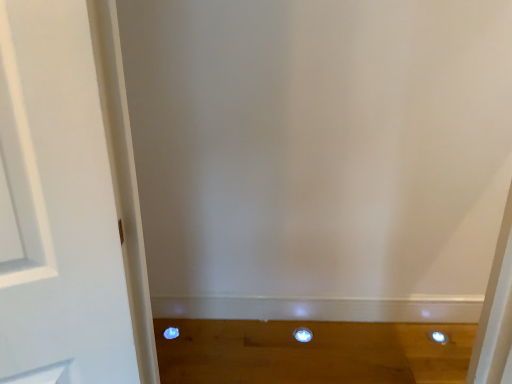
This screenshot has width=512, height=384. I want to click on matte blue dot at lower left, positioned as the 1th dot in left-to-right order, so [170, 333].

The height and width of the screenshot is (384, 512). What do you see at coordinates (170, 333) in the screenshot?
I see `matte blue dot at lower left, positioned as the 1th dot in left-to-right order` at bounding box center [170, 333].

What is the approximate height of matte blue dot at lower left, positioned as the 1th dot in left-to-right order?

The height of matte blue dot at lower left, positioned as the 1th dot in left-to-right order, is 1.21 inches.

Describe the element at coordinates (303, 335) in the screenshot. I see `white glossy dot at center, acting as the second dot starting from the left` at that location.

I want to click on white glossy dot at center, which appears as the 1th dot when viewed from the right, so click(303, 335).

Where is `matte blue dot at lower left, the second dot in the right-to-left sequence`? This screenshot has height=384, width=512. matte blue dot at lower left, the second dot in the right-to-left sequence is located at coordinates (170, 333).

Is matte blue dot at lower left, positioned as the 1th dot in left-to-right order, to the left or to the right of white glossy dot at center, which appears as the 1th dot when viewed from the right, in the image?

From the image, it's evident that matte blue dot at lower left, positioned as the 1th dot in left-to-right order, is to the left of white glossy dot at center, which appears as the 1th dot when viewed from the right.

Relative to white glossy dot at center, acting as the second dot starting from the left, is matte blue dot at lower left, the second dot in the right-to-left sequence, in front or behind?

Visually, matte blue dot at lower left, the second dot in the right-to-left sequence, is located behind white glossy dot at center, acting as the second dot starting from the left.

Which point is more forward, (173,338) or (298,332)?

The point (173,338) is closer to the camera.

From the image's perspective, who appears lower, matte blue dot at lower left, positioned as the 1th dot in left-to-right order, or white glossy dot at center, acting as the second dot starting from the left?

white glossy dot at center, acting as the second dot starting from the left, is shown below in the image.

From a real-world perspective, between matte blue dot at lower left, the second dot in the right-to-left sequence, and white glossy dot at center, which appears as the 1th dot when viewed from the right, who is vertically lower?

matte blue dot at lower left, the second dot in the right-to-left sequence, is physically lower.

In terms of width, does matte blue dot at lower left, the second dot in the right-to-left sequence, look wider or thinner when compared to white glossy dot at center, acting as the second dot starting from the left?

In the image, matte blue dot at lower left, the second dot in the right-to-left sequence, appears to be more narrow than white glossy dot at center, acting as the second dot starting from the left.

Can you confirm if matte blue dot at lower left, positioned as the 1th dot in left-to-right order, is shorter than white glossy dot at center, which appears as the 1th dot when viewed from the right?

Correct, matte blue dot at lower left, positioned as the 1th dot in left-to-right order, is not as tall as white glossy dot at center, which appears as the 1th dot when viewed from the right.

Looking at the image, does matte blue dot at lower left, the second dot in the right-to-left sequence, seem bigger or smaller compared to white glossy dot at center, acting as the second dot starting from the left?

Clearly, matte blue dot at lower left, the second dot in the right-to-left sequence, is smaller in size than white glossy dot at center, acting as the second dot starting from the left.

Would you say matte blue dot at lower left, the second dot in the right-to-left sequence, is outside white glossy dot at center, which appears as the 1th dot when viewed from the right?

Indeed, matte blue dot at lower left, the second dot in the right-to-left sequence, is completely outside white glossy dot at center, which appears as the 1th dot when viewed from the right.

Is matte blue dot at lower left, positioned as the 1th dot in left-to-right order, far from white glossy dot at center, which appears as the 1th dot when viewed from the right?

No.

Is matte blue dot at lower left, the second dot in the right-to-left sequence, oriented away from white glossy dot at center, which appears as the 1th dot when viewed from the right?

No, matte blue dot at lower left, the second dot in the right-to-left sequence, is not facing away from white glossy dot at center, which appears as the 1th dot when viewed from the right.

How many degrees apart are the facing directions of matte blue dot at lower left, positioned as the 1th dot in left-to-right order, and white glossy dot at center, acting as the second dot starting from the left?

0.731 degrees separate the facing orientations of matte blue dot at lower left, positioned as the 1th dot in left-to-right order, and white glossy dot at center, acting as the second dot starting from the left.

How distant is matte blue dot at lower left, positioned as the 1th dot in left-to-right order, from white glossy dot at center, acting as the second dot starting from the left?

matte blue dot at lower left, positioned as the 1th dot in left-to-right order, and white glossy dot at center, acting as the second dot starting from the left, are 22.24 inches apart from each other.

Where is `dot behind the white glossy dot at center, which appears as the 1th dot when viewed from the right`? Image resolution: width=512 pixels, height=384 pixels. dot behind the white glossy dot at center, which appears as the 1th dot when viewed from the right is located at coordinates (170, 333).

Based on the photo, between white glossy dot at center, which appears as the 1th dot when viewed from the right, and matte blue dot at lower left, the second dot in the right-to-left sequence, which one appears on the right side from the viewer's perspective?

From the viewer's perspective, white glossy dot at center, which appears as the 1th dot when viewed from the right, appears more on the right side.

Is white glossy dot at center, acting as the second dot starting from the left, further to the viewer compared to matte blue dot at lower left, positioned as the 1th dot in left-to-right order?

No, it is in front of matte blue dot at lower left, positioned as the 1th dot in left-to-right order.

Between point (310, 337) and point (175, 335), which one is positioned behind?

Positioned behind is point (175, 335).

Consider the image. From the image's perspective, relative to matte blue dot at lower left, the second dot in the right-to-left sequence, is white glossy dot at center, which appears as the 1th dot when viewed from the right, above or below?

From the image's perspective, white glossy dot at center, which appears as the 1th dot when viewed from the right, appears below matte blue dot at lower left, the second dot in the right-to-left sequence.

From a real-world perspective, between white glossy dot at center, acting as the second dot starting from the left, and matte blue dot at lower left, the second dot in the right-to-left sequence, who is vertically higher?

white glossy dot at center, acting as the second dot starting from the left, from a real-world perspective.

Which of these two, white glossy dot at center, acting as the second dot starting from the left, or matte blue dot at lower left, positioned as the 1th dot in left-to-right order, is wider?

With larger width is white glossy dot at center, acting as the second dot starting from the left.

Considering the relative sizes of white glossy dot at center, acting as the second dot starting from the left, and matte blue dot at lower left, the second dot in the right-to-left sequence, in the image provided, is white glossy dot at center, acting as the second dot starting from the left, taller than matte blue dot at lower left, the second dot in the right-to-left sequence,?

Yes, white glossy dot at center, acting as the second dot starting from the left, is taller than matte blue dot at lower left, the second dot in the right-to-left sequence.

Does white glossy dot at center, which appears as the 1th dot when viewed from the right, have a smaller size compared to matte blue dot at lower left, positioned as the 1th dot in left-to-right order?

No.

Would you say white glossy dot at center, acting as the second dot starting from the left, is inside or outside matte blue dot at lower left, positioned as the 1th dot in left-to-right order?

white glossy dot at center, acting as the second dot starting from the left, is not inside matte blue dot at lower left, positioned as the 1th dot in left-to-right order, it's outside.

Is white glossy dot at center, acting as the second dot starting from the left, with matte blue dot at lower left, the second dot in the right-to-left sequence?

No.

Is white glossy dot at center, acting as the second dot starting from the left, aimed at matte blue dot at lower left, positioned as the 1th dot in left-to-right order?

No, white glossy dot at center, acting as the second dot starting from the left, is not aimed at matte blue dot at lower left, positioned as the 1th dot in left-to-right order.

What's the angular difference between white glossy dot at center, which appears as the 1th dot when viewed from the right, and matte blue dot at lower left, the second dot in the right-to-left sequence,'s facing directions?

0.731 degrees separate the facing orientations of white glossy dot at center, which appears as the 1th dot when viewed from the right, and matte blue dot at lower left, the second dot in the right-to-left sequence.

Could you measure the distance between white glossy dot at center, which appears as the 1th dot when viewed from the right, and matte blue dot at lower left, the second dot in the right-to-left sequence?

The distance of white glossy dot at center, which appears as the 1th dot when viewed from the right, from matte blue dot at lower left, the second dot in the right-to-left sequence, is 22.24 inches.

Where is `dot located above the white glossy dot at center, acting as the second dot starting from the left (from the image's perspective)`? The image size is (512, 384). dot located above the white glossy dot at center, acting as the second dot starting from the left (from the image's perspective) is located at coordinates (170, 333).

This screenshot has width=512, height=384. Identify the location of dot that is under the white glossy dot at center, acting as the second dot starting from the left (from a real-world perspective). (170, 333).

Identify the location of dot located above the white glossy dot at center, which appears as the 1th dot when viewed from the right (from the image's perspective). This screenshot has width=512, height=384. (170, 333).